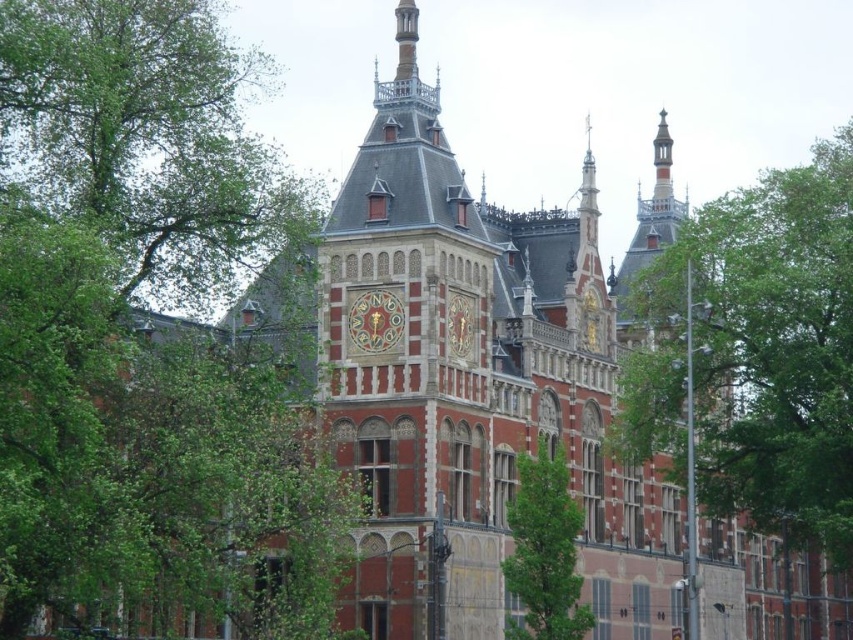
You are an architect designing a new building and want to place a tree in the same relative position as the green leafy tree at upper left in this image. What coordinates should you use?

The green leafy tree at upper left is positioned at coordinates point (148,140), so you should place the new tree at those coordinates.

You are an architect designing a new garden path between the green leafy tree at upper left and the green leafy tree at right. The path must be straight and 10 feet wide. Can the path fit between them without bending around either tree?

The green leafy tree at upper left is 85.86 feet from the green leafy tree at right. Since the path only needs to be 10 feet wide, the distance between the trees is more than sufficient to accommodate the path without bending around either tree.

You are standing in front of the building and see the green leafy tree at upper left and the green leafy tree at lower right. Which tree is positioned more to the left side of the building?

The green leafy tree at upper left is positioned more to the left side of the building than the green leafy tree at lower right.